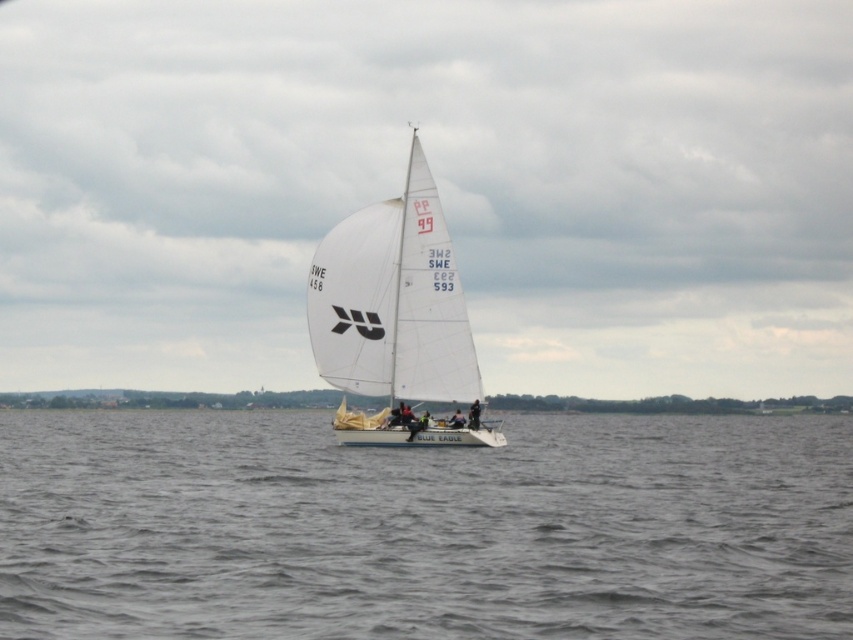
Does gray water at center have a greater width compared to white matte sailboat at center?

Yes, gray water at center is wider than white matte sailboat at center.

Locate an element on the screen. gray water at center is located at coordinates (422, 529).